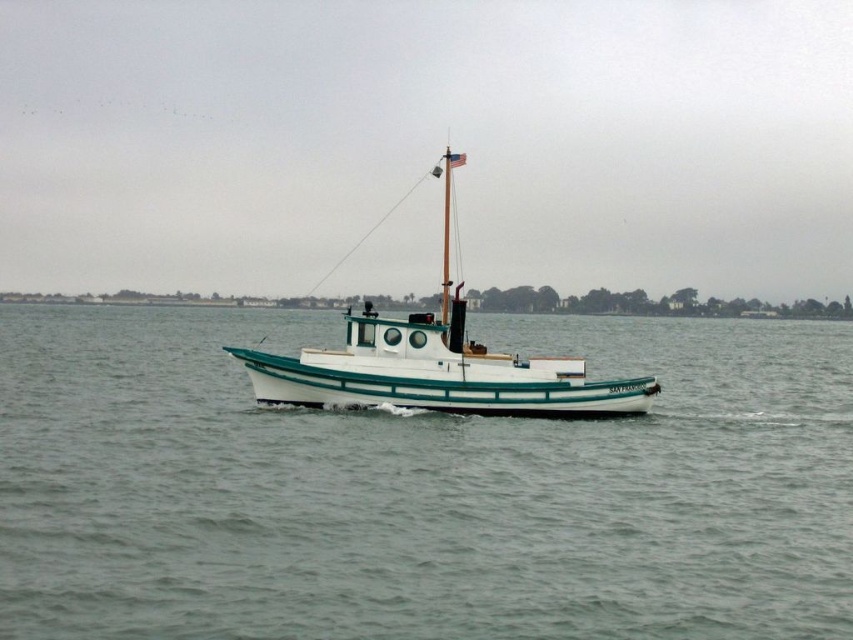
You are an observer on the shore looking at the white glossy boat at center and the white matte water at center. Which object is positioned to the right of the other?

The white matte water at center is to the right of the white glossy boat at center.

You are standing on the dock and looking at the white glossy boat at center and the white matte water at center. Which object is positioned lower in the scene?

The white matte water at center is positioned below the white glossy boat at center, so it is lower in the scene.

You are standing on the deck of the fishing boat and want to throw a fishing net into the water. The net requires a minimum of 10 meters of space to cast properly. Is there enough space between the boat and the white matte water at center to safely cast the net?

The distance between the boat and the white matte water at center is 10.49 meters, which exceeds the minimum required 10 meters. Therefore, there is sufficient space to safely cast the net.